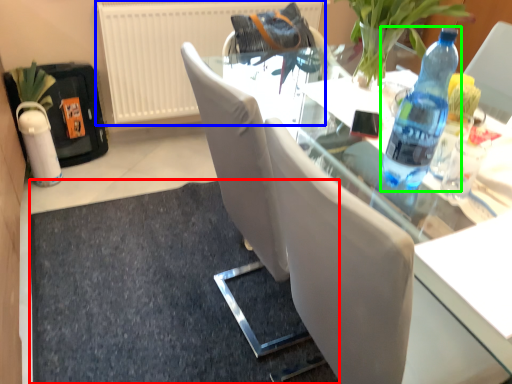
Question: Estimate the real-world distances between objects in this image. Which object is closer to doormat (highlighted by a red box), radiator (highlighted by a blue box) or bottle (highlighted by a green box)?

Choices:
 (A) radiator
 (B) bottle

Answer: (A)